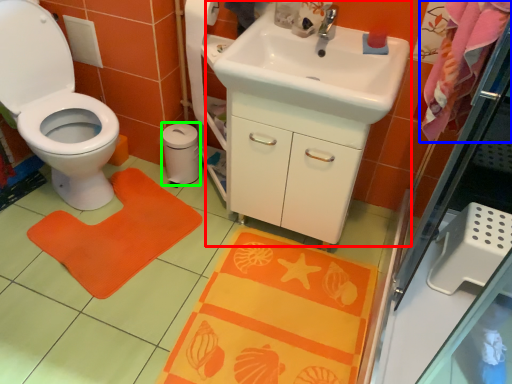
Question: Considering the real-world distances, which object is closest to sink (highlighted by a red box)? beach towel (highlighted by a blue box) or toilet paper (highlighted by a green box).

Choices:
 (A) beach towel
 (B) toilet paper

Answer: (A)